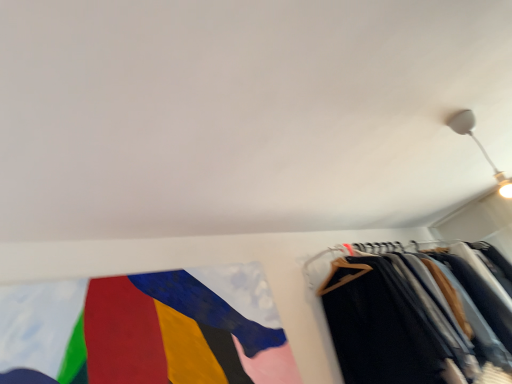
In order to face white glossy light fixture at upper right, should I rotate leftwards or rightwards?

You should rotate right by 28.150 degrees.

The width and height of the screenshot is (512, 384). I want to click on dark gray wool trousers at right, so click(x=396, y=325).

The height and width of the screenshot is (384, 512). In order to click on textured fabric flag at lower left in this screenshot , I will do `click(149, 329)`.

The height and width of the screenshot is (384, 512). What are the coordinates of `white glossy light fixture at upper right` in the screenshot? It's located at (479, 147).

This screenshot has width=512, height=384. What are the coordinates of `trousers below the white glossy light fixture at upper right (from the image's perspective)` in the screenshot? It's located at (396, 325).

Which of these two, dark gray wool trousers at right or white glossy light fixture at upper right, stands shorter?

With less height is white glossy light fixture at upper right.

Which is more to the left, dark gray wool trousers at right or white glossy light fixture at upper right?

white glossy light fixture at upper right is more to the left.

Is dark gray wool trousers at right facing towards white glossy light fixture at upper right?

Yes.

Looking at their sizes, would you say dark gray wool trousers at right is wider or thinner than textured fabric flag at lower left?

Clearly, dark gray wool trousers at right has more width compared to textured fabric flag at lower left.

Which object is closer to the camera taking this photo, dark gray wool trousers at right or textured fabric flag at lower left?

textured fabric flag at lower left is in front.

From the image's perspective, is dark gray wool trousers at right positioned above or below textured fabric flag at lower left?

dark gray wool trousers at right is situated lower than textured fabric flag at lower left in the image.

Is white glossy light fixture at upper right in front of or behind textured fabric flag at lower left in the image?

Clearly, white glossy light fixture at upper right is behind textured fabric flag at lower left.

Does point (467, 122) lie in front of point (81, 326)?

No.

Is textured fabric flag at lower left oriented away from white glossy light fixture at upper right?

textured fabric flag at lower left is not turned away from white glossy light fixture at upper right.

Which object is wider, textured fabric flag at lower left or white glossy light fixture at upper right?

Wider between the two is white glossy light fixture at upper right.

From the image's perspective, is textured fabric flag at lower left located above or below white glossy light fixture at upper right?

textured fabric flag at lower left is below white glossy light fixture at upper right.

Would you say textured fabric flag at lower left is inside or outside white glossy light fixture at upper right?

textured fabric flag at lower left is not inside white glossy light fixture at upper right, it's outside.

How far apart are textured fabric flag at lower left and dark gray wool trousers at right?

textured fabric flag at lower left is 33.25 inches from dark gray wool trousers at right.

Is textured fabric flag at lower left oriented away from dark gray wool trousers at right?

No, textured fabric flag at lower left is not facing away from dark gray wool trousers at right.

Is textured fabric flag at lower left spatially inside dark gray wool trousers at right, or outside of it?

textured fabric flag at lower left is outside dark gray wool trousers at right.

Does textured fabric flag at lower left have a lesser width compared to dark gray wool trousers at right?

Yes, textured fabric flag at lower left is thinner than dark gray wool trousers at right.

From a real-world perspective, which is physically above, white glossy light fixture at upper right or dark gray wool trousers at right?

In real-world perspective, white glossy light fixture at upper right is above.

Is white glossy light fixture at upper right placed right next to dark gray wool trousers at right?

white glossy light fixture at upper right and dark gray wool trousers at right are clearly separated.

Consider the image. Which is closer to the camera, (452, 123) or (359, 305)?

Point (452, 123)

Based on their positions, is white glossy light fixture at upper right located to the left or right of dark gray wool trousers at right?

Clearly, white glossy light fixture at upper right is on the left of dark gray wool trousers at right in the image.

In order to click on light fixture above the dark gray wool trousers at right (from the image's perspective) in this screenshot , I will do `click(479, 147)`.

Find the location of a particular element. flag located on the left of dark gray wool trousers at right is located at coordinates (149, 329).

Based on their spatial positions, is white glossy light fixture at upper right or textured fabric flag at lower left closer to dark gray wool trousers at right?

textured fabric flag at lower left is closer to dark gray wool trousers at right.

Consider the image. Estimate the real-world distances between objects in this image. Which object is closer to white glossy light fixture at upper right, textured fabric flag at lower left or dark gray wool trousers at right?

Among the two, dark gray wool trousers at right is located nearer to white glossy light fixture at upper right.

When comparing their distances from textured fabric flag at lower left, does white glossy light fixture at upper right or dark gray wool trousers at right seem further?

white glossy light fixture at upper right lies further to textured fabric flag at lower left than the other object.

Estimate the real-world distances between objects in this image. Which object is closer to dark gray wool trousers at right, textured fabric flag at lower left or white glossy light fixture at upper right?

textured fabric flag at lower left lies closer to dark gray wool trousers at right than the other object.

Which object lies further to the anchor point white glossy light fixture at upper right, dark gray wool trousers at right or textured fabric flag at lower left?

Among the two, textured fabric flag at lower left is located further to white glossy light fixture at upper right.

Which object lies further to the anchor point textured fabric flag at lower left, dark gray wool trousers at right or white glossy light fixture at upper right?

Based on the image, white glossy light fixture at upper right appears to be further to textured fabric flag at lower left.

Image resolution: width=512 pixels, height=384 pixels. In order to click on light fixture situated between textured fabric flag at lower left and dark gray wool trousers at right from left to right in this screenshot , I will do `click(479, 147)`.